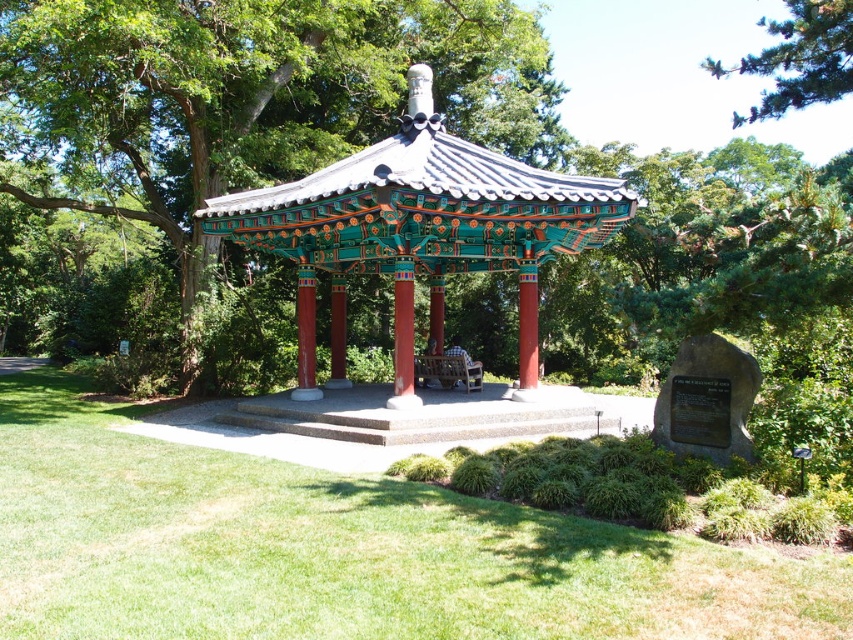
You are standing at the entrance of the traditional Korean pavilion and notice a specific point marked at coordinates point (340, 548). What is located at this point?

The point (340, 548) indicates green grass at center.

You are standing in the park and want to take a photo of the multicolored painted gazebo at center. If you are positioned at point 0.361 on the x axis, what y axis coordinate should you move to in order to frame the gazebo properly?

The multicolored painted gazebo at center is located at point 0.491 on the y axis, so you should move to that coordinate to frame it properly.

You are standing in front of the pavilion and want to determine the relative positions of two points marked in the image. Which point is closer to you, point 1 at coordinates point 1 at coordinates point (6, 458) or point 2 at coordinates point (457, 372)?

Point 1 at coordinates point (6, 458) is closer to the viewer than point 2 at coordinates point (457, 372).